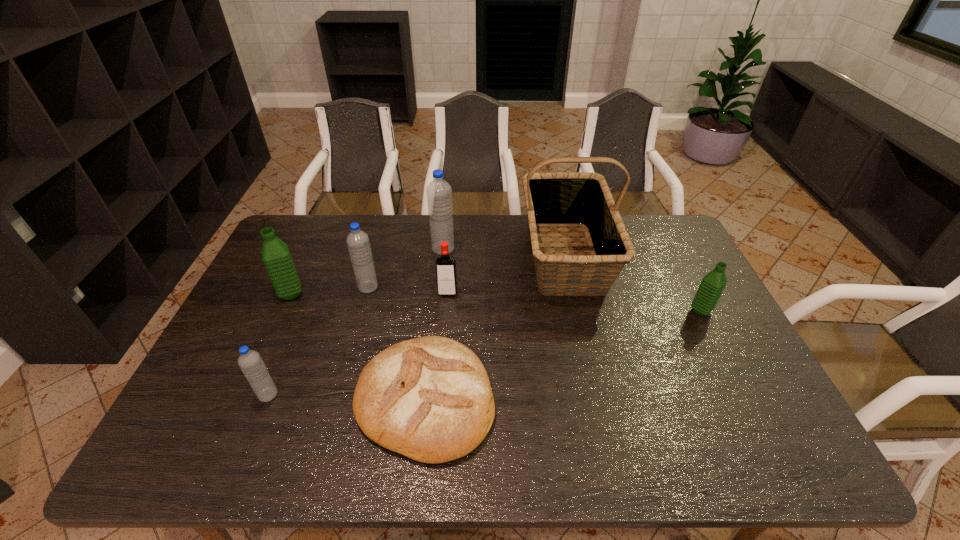
This screenshot has width=960, height=540. Identify the location of the smallest blue water bottle. (250, 361).

Where is `the nearest water bottle`? the nearest water bottle is located at coordinates (250, 361).

Identify the location of the shortest object. (429, 398).

Locate an element on the screen. This screenshot has height=540, width=960. vacant space located by the handle of the basket is located at coordinates (585, 338).

Image resolution: width=960 pixels, height=540 pixels. Identify the location of vacant region located on the left of the tallest water bottle. (373, 249).

Where is `free region located on the back of the left green water bottle`? This screenshot has width=960, height=540. free region located on the back of the left green water bottle is located at coordinates (309, 253).

The image size is (960, 540). I want to click on vacant region located 0.180m on the back of the second nearest blue water bottle, so click(x=379, y=246).

In order to click on vacant space situated 0.220m on the front and back of the red vodka in this screenshot , I will do `click(443, 355)`.

Where is `vacant area situated on the back of the right green water bottle`? The height and width of the screenshot is (540, 960). vacant area situated on the back of the right green water bottle is located at coordinates (666, 244).

Identify the location of free space located on the right of the nearest water bottle. (391, 395).